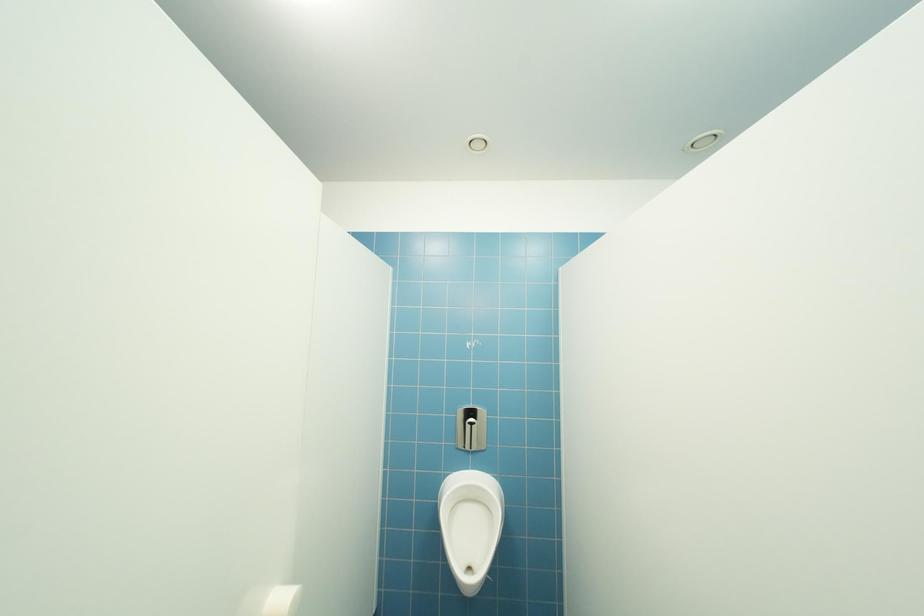
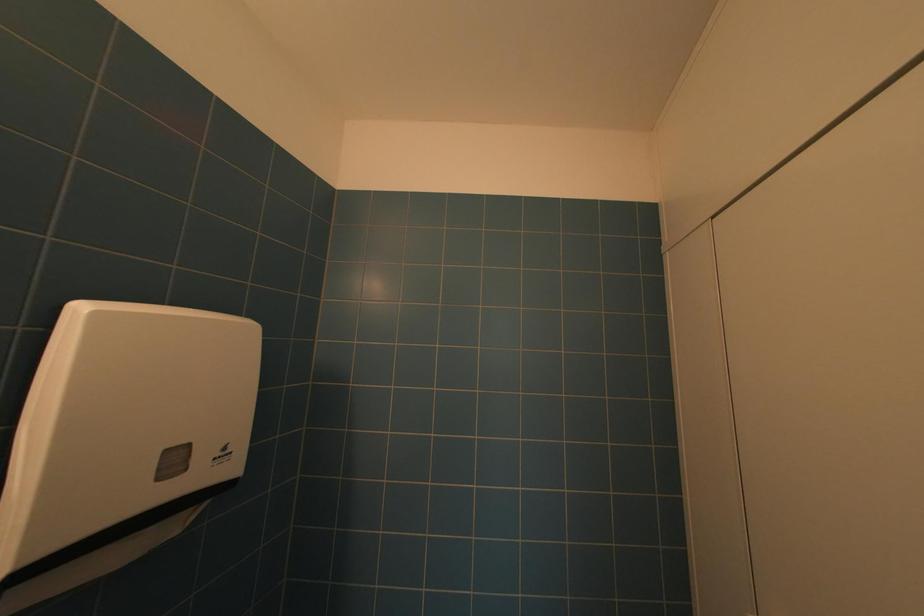
Question: How did the camera likely rotate?

Choices:
 (A) Left
 (B) Right
 (C) Up
 (D) Down

Answer: (A)